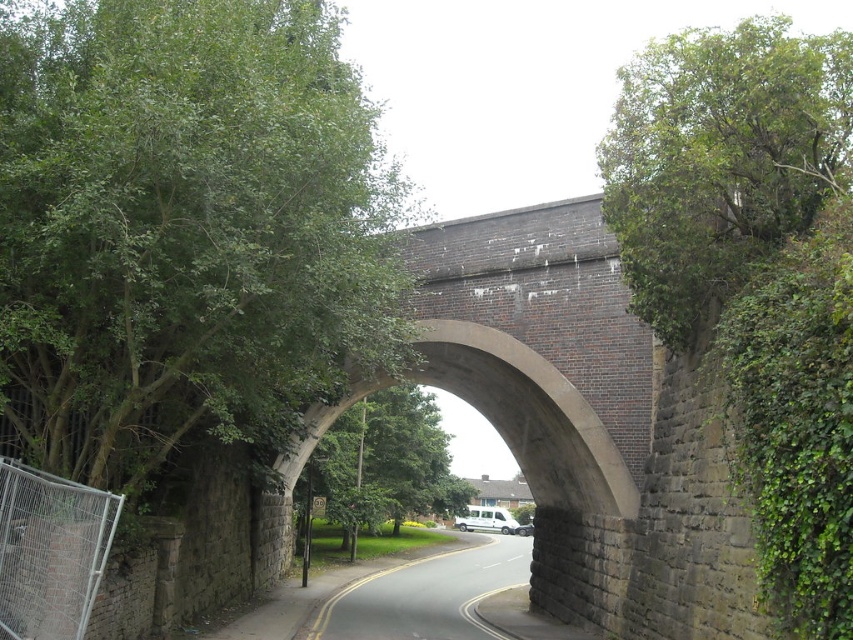
You are standing at the center of the road under the stone archway and want to look towards the green leafy tree at upper left. Which direction should you turn to face the point at coordinates (184, 227)?

The point at coordinates (184, 227) is located on the green leafy tree at upper left, so you should turn to face the upper left direction to look towards it.